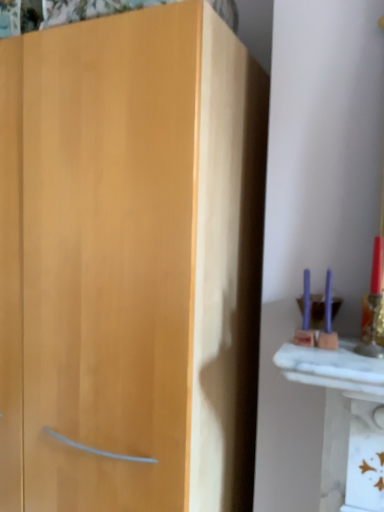
Image resolution: width=384 pixels, height=512 pixels. What do you see at coordinates (324, 319) in the screenshot? I see `matte purple glass candle holder at right` at bounding box center [324, 319].

Measure the distance between matte purple glass candle holder at right and camera.

The depth of matte purple glass candle holder at right is 36.02 inches.

In order to click on matte purple glass candle holder at right in this screenshot , I will do `click(324, 319)`.

Where is `matte purple glass candle holder at right`? Image resolution: width=384 pixels, height=512 pixels. matte purple glass candle holder at right is located at coordinates (324, 319).